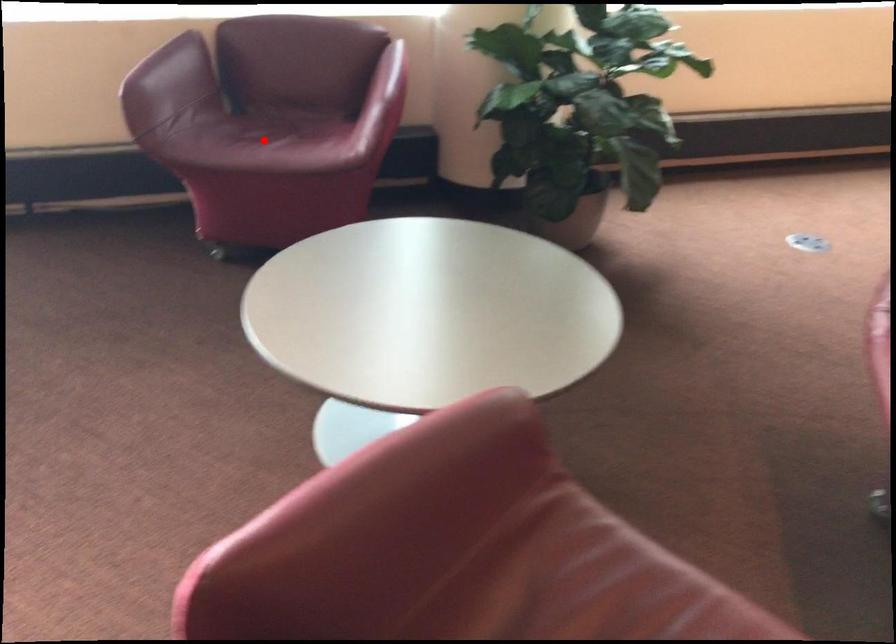
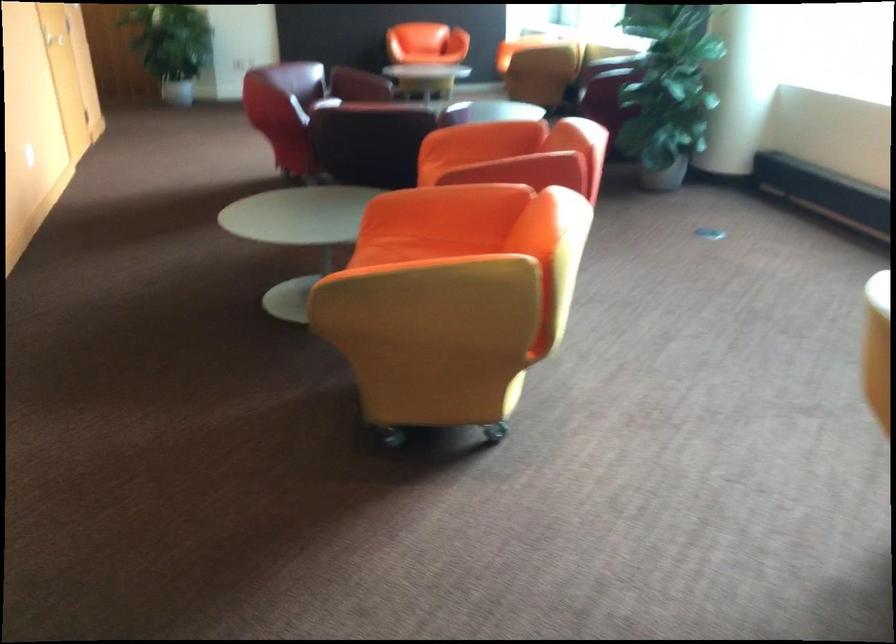
Question: I am providing you with two images of the same scene from different viewpoints. A red point is marked on the first image. At the location where the point appears in image 1, is it still visible in image 2?

Choices:
 (A) Yes
 (B) No

Answer: (B)